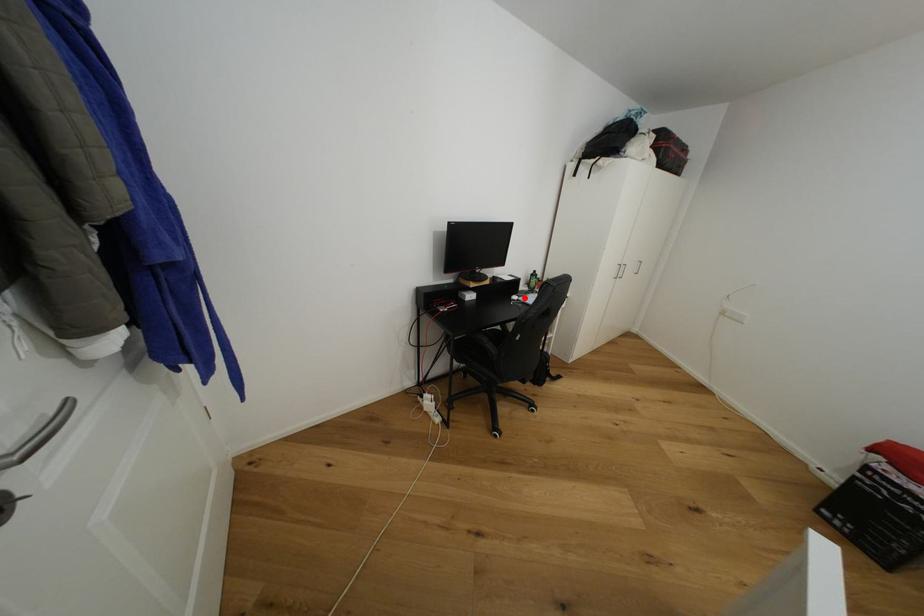
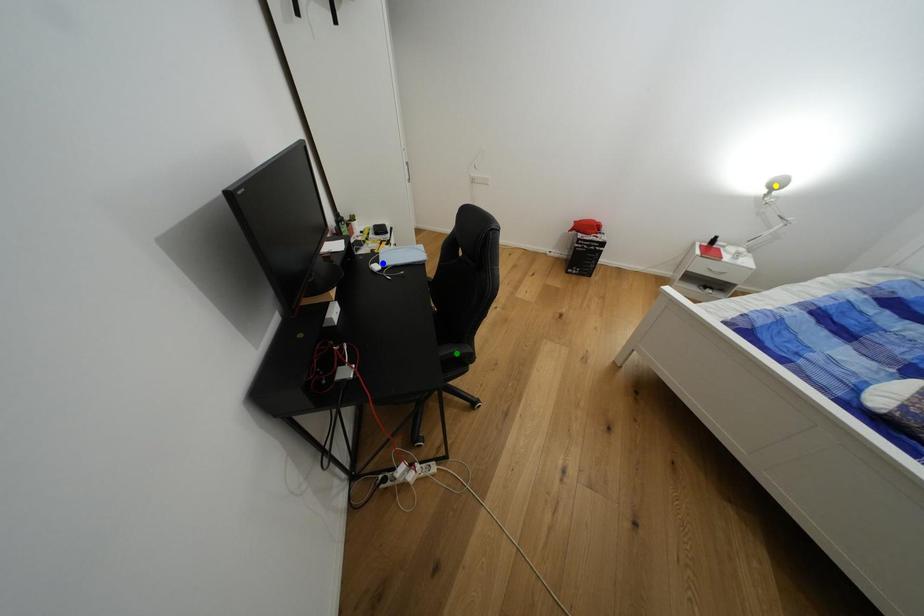
Question: I am providing you with two images of the same scene from different viewpoints. A red point is marked on the first image. You are given multiple points on the second image. In image 2, which mark is for the same physical point as the one in image 1?

Choices:
 (A) yellow point
 (B) green point
 (C) blue point

Answer: (C)